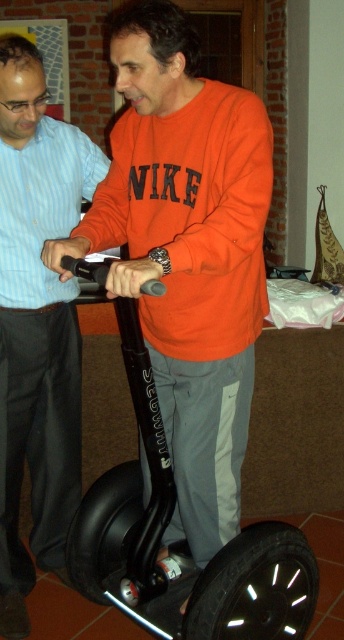
You are standing in the room and want to reach the point at coordinates point (160, 131). The Segway personal transporter is between you and that point. Is the Segway personal transporter closer to you or to the point?

The point (160, 131) is 5.29 feet from the viewer. Since the Segway is between you and the point, the Segway is closer to you than the point.

You are standing at the origin of a coordinate system in the image. There is a point labeled as point (187, 253). Based on the scene description, what object is located at that point?

The point (187, 253) corresponds to the orange matte sweatshirt at center.

You are a delivery person who needs to quickly grab a scooter to deliver a package. There are two scooters available in the scene, a matte black scooter at center and a black rubber scooter at center. Which scooter is closer to you?

The matte black scooter at center and black rubber scooter at center are 20.14 inches apart, but the exact distance between them is not specified in terms of which is closer. Therefore, I cannot determine which scooter is closer based on the provided information.